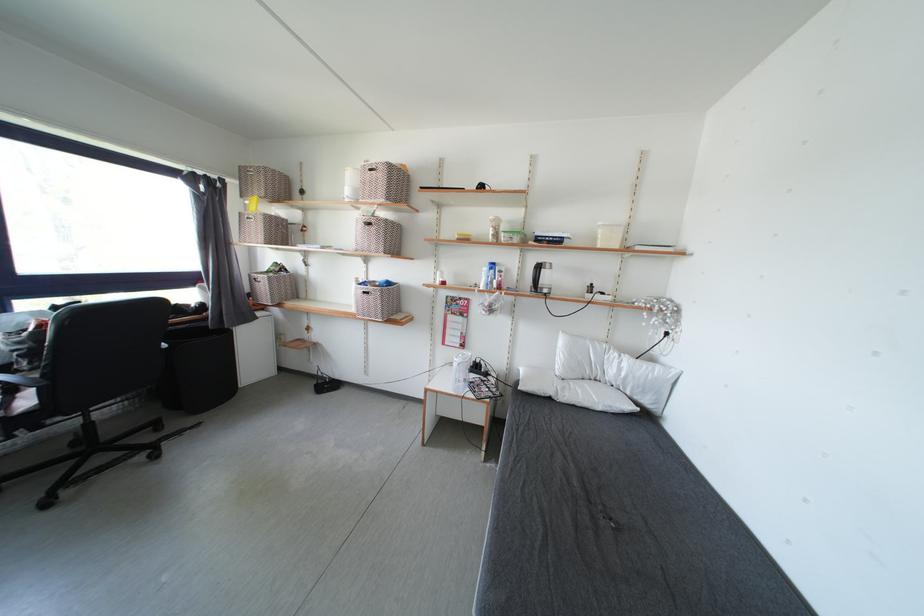
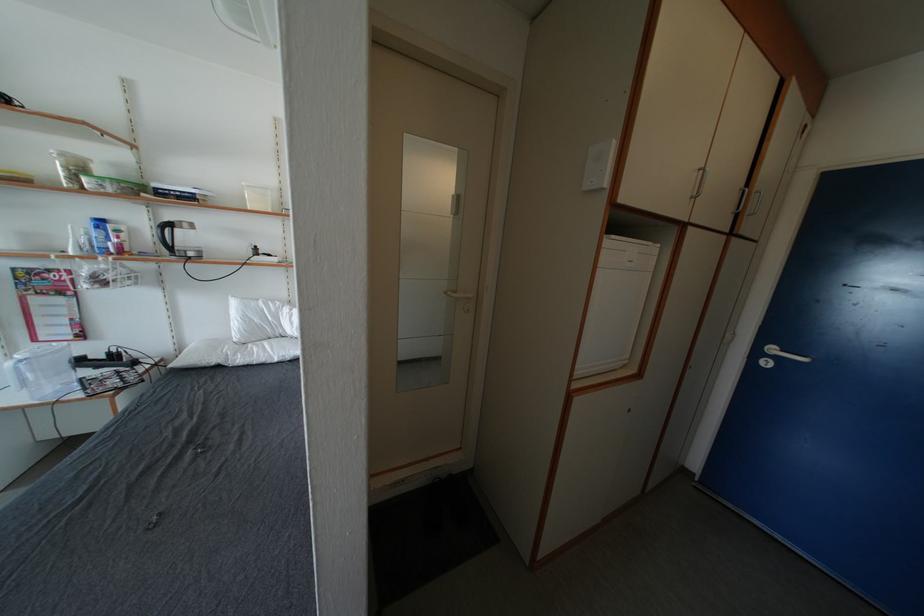
Locate, in the second image, the point that corresponds to point (481, 368) in the first image.

(116, 359)